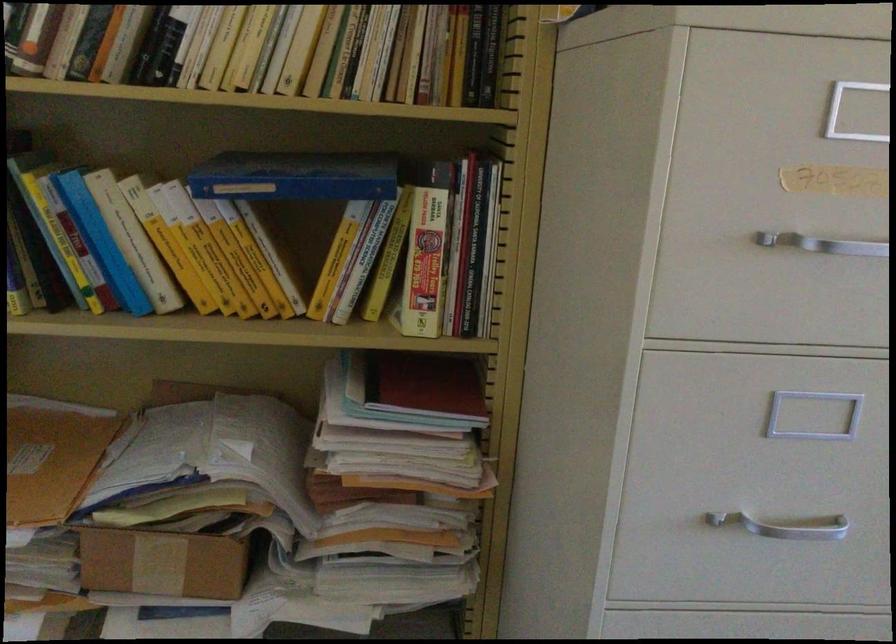
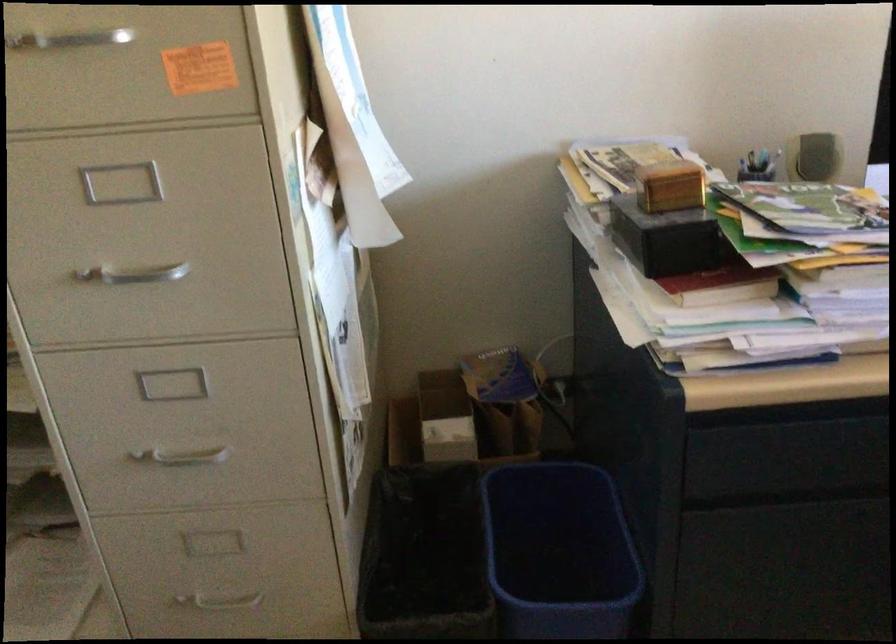
Question: How did the camera likely rotate?

Choices:
 (A) Left
 (B) Right
 (C) Up
 (D) Down

Answer: (D)